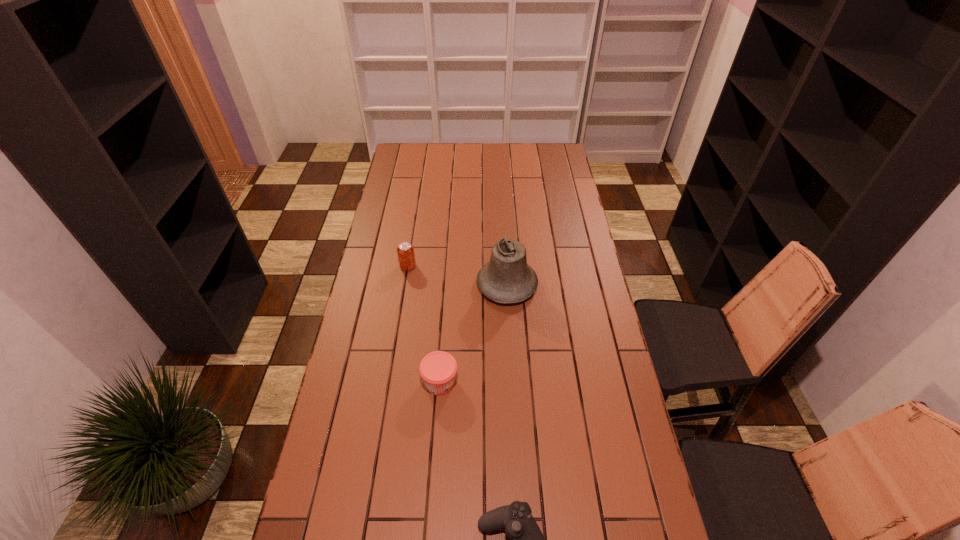
Where is `the tallest object`? This screenshot has height=540, width=960. the tallest object is located at coordinates (507, 278).

Identify the location of the leftmost object. pos(406,256).

Image resolution: width=960 pixels, height=540 pixels. Find the location of `jam`. jam is located at coordinates (438, 369).

I want to click on the second nearest object, so click(438, 369).

Where is `blank space located on the front of the bell`? This screenshot has width=960, height=540. blank space located on the front of the bell is located at coordinates (514, 398).

At what (x,y) coordinates should I click in order to perform the action: click on free location located 0.400m on the right of the can. Please return your answer as a coordinate pair (x, y). The width and height of the screenshot is (960, 540). Looking at the image, I should click on (516, 266).

Where is `free region located 0.290m on the front label of the second nearest object`? This screenshot has width=960, height=540. free region located 0.290m on the front label of the second nearest object is located at coordinates (550, 382).

The image size is (960, 540). I want to click on object that is at the left edge, so click(406, 256).

What are the coordinates of `vacant region at the far edge of the desktop` in the screenshot? It's located at (469, 149).

The width and height of the screenshot is (960, 540). I want to click on free space at the left edge, so 398,284.